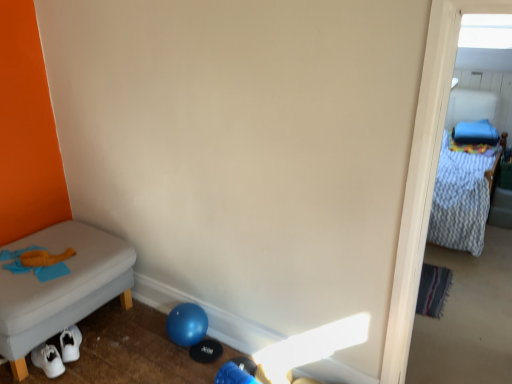
The width and height of the screenshot is (512, 384). Describe the element at coordinates (61, 287) in the screenshot. I see `gray fabric bench at left` at that location.

Find the location of a particular element. gray fabric bench at left is located at coordinates pyautogui.click(x=61, y=287).

At what (x,y) coordinates should I click in order to perform the action: click on gray fabric bench at left. Please return your answer as a coordinate pair (x, y). Looking at the image, I should click on (61, 287).